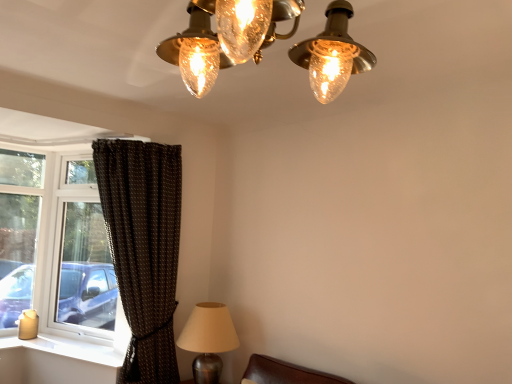
Question: Is metallic silver lamp at lower left at the left side of white plastic window sill at lower left?

Choices:
 (A) yes
 (B) no

Answer: (B)

Question: Considering the relative sizes of metallic silver lamp at lower left and white plastic window sill at lower left in the image provided, is metallic silver lamp at lower left bigger than white plastic window sill at lower left?

Choices:
 (A) no
 (B) yes

Answer: (B)

Question: Could you tell me if metallic silver lamp at lower left is turned towards white plastic window sill at lower left?

Choices:
 (A) no
 (B) yes

Answer: (A)

Question: Is metallic silver lamp at lower left placed right next to white plastic window sill at lower left?

Choices:
 (A) no
 (B) yes

Answer: (A)

Question: From a real-world perspective, is metallic silver lamp at lower left under white plastic window sill at lower left?

Choices:
 (A) yes
 (B) no

Answer: (B)

Question: Can you confirm if metallic silver lamp at lower left is thinner than white plastic window sill at lower left?

Choices:
 (A) yes
 (B) no

Answer: (B)

Question: Can you confirm if white plastic window sill at lower left is wider than brown textured curtain at left?

Choices:
 (A) no
 (B) yes

Answer: (A)

Question: Considering the relative positions of white plastic window sill at lower left and brown textured curtain at left in the image provided, is white plastic window sill at lower left to the right of brown textured curtain at left from the viewer's perspective?

Choices:
 (A) no
 (B) yes

Answer: (A)

Question: Considering the relative sizes of white plastic window sill at lower left and brown textured curtain at left in the image provided, is white plastic window sill at lower left shorter than brown textured curtain at left?

Choices:
 (A) yes
 (B) no

Answer: (A)

Question: Is white plastic window sill at lower left outside of brown textured curtain at left?

Choices:
 (A) no
 (B) yes

Answer: (B)

Question: Considering the relative sizes of white plastic window sill at lower left and brown textured curtain at left in the image provided, is white plastic window sill at lower left smaller than brown textured curtain at left?

Choices:
 (A) yes
 (B) no

Answer: (A)

Question: Does white plastic window sill at lower left have a lesser width compared to brown textured curtain at left?

Choices:
 (A) no
 (B) yes

Answer: (B)

Question: Can you confirm if metallic silver lamp at lower left is wider than clear glass window at left?

Choices:
 (A) no
 (B) yes

Answer: (B)